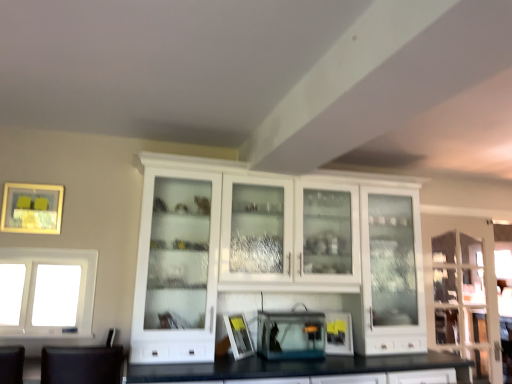
What do you see at coordinates (239, 335) in the screenshot? I see `white matte picture frame at center, placed as the 2th picture frame when sorted from top to bottom` at bounding box center [239, 335].

The image size is (512, 384). I want to click on white glass window at left, so (52, 292).

In order to face white glass cabinet at center, should I rotate leftwards or rightwards?

Rotate right and turn 5.892 degrees.

This screenshot has height=384, width=512. I want to click on transparent plastic aquarium at center, the 1th appliance when ordered from left to right, so coord(291,335).

Measure the distance between point (x=448, y=286) and camera.

Point (x=448, y=286) is 3.55 meters away from camera.

Locate an element on the screen. This screenshot has height=384, width=512. matte gold picture frame at upper left, the first picture frame in the top-to-bottom sequence is located at coordinates (32, 208).

Locate an element on the screen. The width and height of the screenshot is (512, 384). white matte picture frame at center, placed as the 2th picture frame when sorted from top to bottom is located at coordinates (239, 335).

Between point (158, 211) and point (234, 317), which one is positioned in front?

The point (158, 211) is in front.

In the scene shown: Considering the relative sizes of white glass cabinet at center and white matte picture frame at center, which is the 1th picture frame in bottom-to-top order, in the image provided, is white glass cabinet at center bigger than white matte picture frame at center, which is the 1th picture frame in bottom-to-top order,?

Yes, white glass cabinet at center is bigger than white matte picture frame at center, which is the 1th picture frame in bottom-to-top order.

Consider the image. Is white glass cabinet at center to the left or to the right of white matte picture frame at center, which appears as the 2th picture frame when viewed from the left, in the image?

Based on their positions, white glass cabinet at center is located to the right of white matte picture frame at center, which appears as the 2th picture frame when viewed from the left.

The height and width of the screenshot is (384, 512). I want to click on the 1st picture frame counting from the left side of the white glass cabinet at center, so click(239, 335).

Considering the sizes of objects white glass window at left and transparent plastic aquarium at center, placed as the 2th appliance when sorted from right to left, in the image provided, who is shorter, white glass window at left or transparent plastic aquarium at center, placed as the 2th appliance when sorted from right to left,?

transparent plastic aquarium at center, placed as the 2th appliance when sorted from right to left, is shorter.

From the image's perspective, who appears lower, white glass window at left or transparent plastic aquarium at center, the 1th appliance when ordered from left to right?

From the image's view, transparent plastic aquarium at center, the 1th appliance when ordered from left to right, is below.

Which of these two, white matte picture frame at center, which is the 1th picture frame in bottom-to-top order, or transparent plastic aquarium at center, the 1th appliance when ordered from left to right, is smaller?

With smaller size is white matte picture frame at center, which is the 1th picture frame in bottom-to-top order.

Which object is thinner, white matte picture frame at center, which appears as the 2th picture frame when viewed from the left, or transparent plastic aquarium at center, the 1th appliance when ordered from left to right?

white matte picture frame at center, which appears as the 2th picture frame when viewed from the left, is thinner.

Which is more to the right, white matte picture frame at center, the first picture frame when ordered from right to left, or transparent plastic aquarium at center, placed as the 2th appliance when sorted from right to left?

From the viewer's perspective, transparent plastic aquarium at center, placed as the 2th appliance when sorted from right to left, appears more on the right side.

From a real-world perspective, who is located higher, white matte picture frame at center, which is the 1th picture frame in bottom-to-top order, or transparent plastic aquarium at center, the 1th appliance when ordered from left to right?

transparent plastic aquarium at center, the 1th appliance when ordered from left to right, from a real-world perspective.

Between white matte picture frame at center, which appears as the 2th picture frame when viewed from the left, and matte gold picture frame at upper left, placed as the 1th picture frame when sorted from left to right, which one has more height?

Standing taller between the two is matte gold picture frame at upper left, placed as the 1th picture frame when sorted from left to right.

Would you say white matte picture frame at center, which appears as the 2th picture frame when viewed from the left, is a long distance from matte gold picture frame at upper left, placed as the 1th picture frame when sorted from left to right?

Yes, white matte picture frame at center, which appears as the 2th picture frame when viewed from the left, is far from matte gold picture frame at upper left, placed as the 1th picture frame when sorted from left to right.

The height and width of the screenshot is (384, 512). What are the coordinates of `picture frame positioned vertically above the white matte picture frame at center, which appears as the 2th picture frame when viewed from the left (from a real-world perspective)` in the screenshot? It's located at (32, 208).

Between white matte picture frame at center, the first picture frame when ordered from right to left, and matte gold picture frame at upper left, the 2th picture frame positioned from the bottom, which one has larger size?

white matte picture frame at center, the first picture frame when ordered from right to left.

What's the angular difference between matte black toaster at center, the 1th appliance in the right-to-left sequence, and transparent plastic aquarium at center, placed as the 2th appliance when sorted from right to left,'s facing directions?

The facing directions of matte black toaster at center, the 1th appliance in the right-to-left sequence, and transparent plastic aquarium at center, placed as the 2th appliance when sorted from right to left, are 22.9 degrees apart.

From the picture: Measure the distance from matte black toaster at center, which ranks as the 2th appliance in left-to-right order, to transparent plastic aquarium at center, the 1th appliance when ordered from left to right.

They are 8.47 inches apart.

From the picture: Which object is positioned more to the left, matte black toaster at center, the 1th appliance in the right-to-left sequence, or transparent plastic aquarium at center, the 1th appliance when ordered from left to right?

From the viewer's perspective, transparent plastic aquarium at center, the 1th appliance when ordered from left to right, appears more on the left side.

Which of these two, matte black toaster at center, which ranks as the 2th appliance in left-to-right order, or transparent plastic aquarium at center, placed as the 2th appliance when sorted from right to left, is wider?

transparent plastic aquarium at center, placed as the 2th appliance when sorted from right to left, is wider.

Would you say transparent plastic aquarium at center, the 1th appliance when ordered from left to right, is to the left or to the right of white matte picture frame at center, placed as the 2th picture frame when sorted from top to bottom, in the picture?

Clearly, transparent plastic aquarium at center, the 1th appliance when ordered from left to right, is on the right of white matte picture frame at center, placed as the 2th picture frame when sorted from top to bottom, in the image.

Can you tell me how much transparent plastic aquarium at center, placed as the 2th appliance when sorted from right to left, and white matte picture frame at center, placed as the 2th picture frame when sorted from top to bottom, differ in facing direction?

The angular difference between transparent plastic aquarium at center, placed as the 2th appliance when sorted from right to left, and white matte picture frame at center, placed as the 2th picture frame when sorted from top to bottom, is 44.5 degrees.

From the image's perspective, is transparent plastic aquarium at center, the 1th appliance when ordered from left to right, positioned above or below white matte picture frame at center, which is the 1th picture frame in bottom-to-top order?

Based on their image positions, transparent plastic aquarium at center, the 1th appliance when ordered from left to right, is located beneath white matte picture frame at center, which is the 1th picture frame in bottom-to-top order.

Can you confirm if transparent plastic aquarium at center, placed as the 2th appliance when sorted from right to left, is shorter than white matte picture frame at center, the first picture frame when ordered from right to left?

Indeed, transparent plastic aquarium at center, placed as the 2th appliance when sorted from right to left, has a lesser height compared to white matte picture frame at center, the first picture frame when ordered from right to left.

From a real-world perspective, which is physically above, white glass window at left or white matte picture frame at center, the first picture frame when ordered from right to left?

white glass window at left is physically above.

Considering the sizes of white glass window at left and white matte picture frame at center, which is the 1th picture frame in bottom-to-top order, in the image, is white glass window at left taller or shorter than white matte picture frame at center, which is the 1th picture frame in bottom-to-top order,?

Clearly, white glass window at left is taller compared to white matte picture frame at center, which is the 1th picture frame in bottom-to-top order.

Is white glass window at left positioned with its back to white matte picture frame at center, the first picture frame when ordered from right to left?

No, white matte picture frame at center, the first picture frame when ordered from right to left, is not at the back of white glass window at left.

Is white glass window at left with white matte picture frame at center, which is the 1th picture frame in bottom-to-top order?

No, white glass window at left is not in contact with white matte picture frame at center, which is the 1th picture frame in bottom-to-top order.

Where is `cabinetry above the white matte picture frame at center, which appears as the 2th picture frame when viewed from the left (from a real-world perspective)`? cabinetry above the white matte picture frame at center, which appears as the 2th picture frame when viewed from the left (from a real-world perspective) is located at coordinates point(273,252).

There is a white glass window at left. Find the location of `the 1st appliance below it (from the image's perspective)`. the 1st appliance below it (from the image's perspective) is located at coordinates (291, 335).

Looking at the image, which one is located closer to white matte picture frame at center, which appears as the 2th picture frame when viewed from the left, clear glass cabinet at right or transparent plastic aquarium at center, placed as the 2th appliance when sorted from right to left?

The object closer to white matte picture frame at center, which appears as the 2th picture frame when viewed from the left, is transparent plastic aquarium at center, placed as the 2th appliance when sorted from right to left.

Which object lies nearer to the anchor point transparent plastic aquarium at center, the 1th appliance when ordered from left to right, matte gold picture frame at upper left, placed as the 1th picture frame when sorted from left to right, or white matte picture frame at center, the first picture frame when ordered from right to left?

Based on the image, white matte picture frame at center, the first picture frame when ordered from right to left, appears to be nearer to transparent plastic aquarium at center, the 1th appliance when ordered from left to right.

Looking at this image, which object lies further to the anchor point white glass window at left, white matte picture frame at center, placed as the 2th picture frame when sorted from top to bottom, or matte black toaster at center, which ranks as the 2th appliance in left-to-right order?

Among the two, matte black toaster at center, which ranks as the 2th appliance in left-to-right order, is located further to white glass window at left.

Considering their positions, is white matte picture frame at center, which appears as the 2th picture frame when viewed from the left, positioned further to clear glass cabinet at right than transparent plastic aquarium at center, the 1th appliance when ordered from left to right?

Among the two, white matte picture frame at center, which appears as the 2th picture frame when viewed from the left, is located further to clear glass cabinet at right.

Estimate the real-world distances between objects in this image. Which object is closer to matte gold picture frame at upper left, the 2th picture frame positioned from the bottom, white glass cabinet at center or matte black toaster at center, which ranks as the 2th appliance in left-to-right order?

The object closer to matte gold picture frame at upper left, the 2th picture frame positioned from the bottom, is white glass cabinet at center.

Looking at the image, which one is located closer to transparent plastic aquarium at center, the 1th appliance when ordered from left to right, white glass window at left or white matte picture frame at center, the first picture frame when ordered from right to left?

white matte picture frame at center, the first picture frame when ordered from right to left, lies closer to transparent plastic aquarium at center, the 1th appliance when ordered from left to right, than the other object.

When comparing their distances from white matte picture frame at center, which is the 1th picture frame in bottom-to-top order, does white glass cabinet at center or white glass window at left seem closer?

white glass cabinet at center is positioned closer to the anchor white matte picture frame at center, which is the 1th picture frame in bottom-to-top order.

Looking at the image, which one is located further to white matte picture frame at center, which is the 1th picture frame in bottom-to-top order, matte black toaster at center, the 1th appliance in the right-to-left sequence, or white glass window at left?

The object further to white matte picture frame at center, which is the 1th picture frame in bottom-to-top order, is white glass window at left.

Find the location of a particular element. The width and height of the screenshot is (512, 384). appliance between transparent plastic aquarium at center, placed as the 2th appliance when sorted from right to left, and clear glass cabinet at right is located at coordinates (339, 333).

Where is `window situated between matte gold picture frame at upper left, the first picture frame in the top-to-bottom sequence, and white glass cabinet at center from left to right`? The height and width of the screenshot is (384, 512). window situated between matte gold picture frame at upper left, the first picture frame in the top-to-bottom sequence, and white glass cabinet at center from left to right is located at coordinates [52, 292].

What are the coordinates of `picture frame between white glass window at left and white glass cabinet at center from left to right` in the screenshot? It's located at (239, 335).

Where is `window between matte gold picture frame at upper left, placed as the 1th picture frame when sorted from left to right, and clear glass cabinet at right`? This screenshot has width=512, height=384. window between matte gold picture frame at upper left, placed as the 1th picture frame when sorted from left to right, and clear glass cabinet at right is located at coordinates (52, 292).